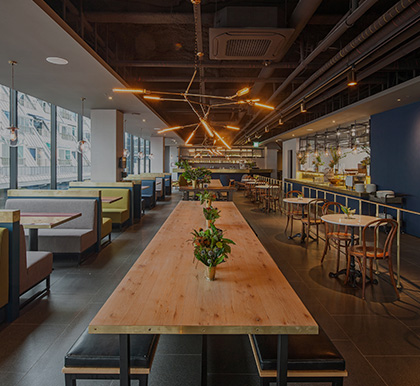
The width and height of the screenshot is (420, 386). I want to click on center table plants, so pos(191,174), pos(206,193), pos(207,213), pos(212,258), pos(201,184).